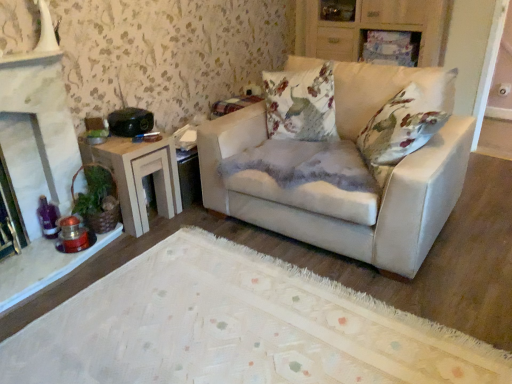
Question: Does white stone fireplace at left have a greater height compared to wooden cabinet at upper center?

Choices:
 (A) yes
 (B) no

Answer: (A)

Question: Is white stone fireplace at left positioned with its back to wooden cabinet at upper center?

Choices:
 (A) yes
 (B) no

Answer: (B)

Question: Would you consider white stone fireplace at left to be distant from wooden cabinet at upper center?

Choices:
 (A) yes
 (B) no

Answer: (A)

Question: Is white stone fireplace at left outside of wooden cabinet at upper center?

Choices:
 (A) yes
 (B) no

Answer: (A)

Question: Could you tell me if white stone fireplace at left is facing wooden cabinet at upper center?

Choices:
 (A) no
 (B) yes

Answer: (A)

Question: Is white stone fireplace at left bigger than wooden cabinet at upper center?

Choices:
 (A) no
 (B) yes

Answer: (A)

Question: Can you confirm if wooden side table at left is thinner than white stone fireplace at left?

Choices:
 (A) no
 (B) yes

Answer: (A)

Question: From the image's perspective, would you say wooden side table at left is shown under white stone fireplace at left?

Choices:
 (A) no
 (B) yes

Answer: (B)

Question: Can we say wooden side table at left lies outside white stone fireplace at left?

Choices:
 (A) yes
 (B) no

Answer: (A)

Question: From a real-world perspective, does wooden side table at left stand above white stone fireplace at left?

Choices:
 (A) no
 (B) yes

Answer: (A)

Question: Is wooden side table at left taller than white stone fireplace at left?

Choices:
 (A) yes
 (B) no

Answer: (B)

Question: Does wooden side table at left appear on the right side of white stone fireplace at left?

Choices:
 (A) no
 (B) yes

Answer: (B)

Question: Does white stone fireplace at left appear on the left side of wooden side table at left?

Choices:
 (A) yes
 (B) no

Answer: (A)